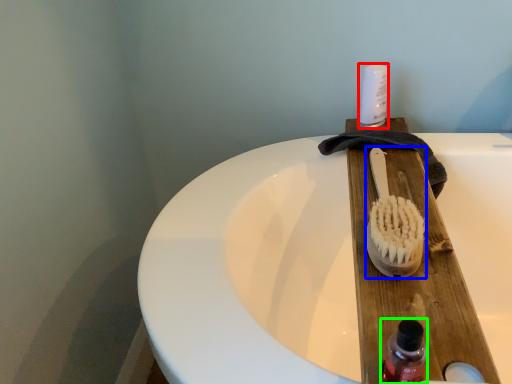
Question: Which object is the closest to the toiletry (highlighted by a red box)? Choose among these: brush (highlighted by a blue box) or bottle (highlighted by a green box).

Choices:
 (A) brush
 (B) bottle

Answer: (A)